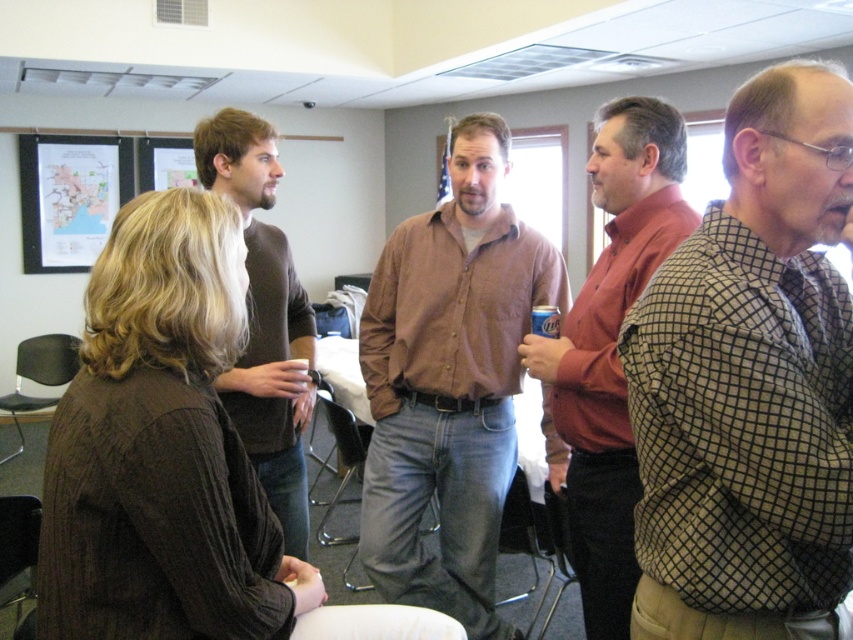
Can you confirm if brown shirt at center is positioned above dark brown sweater at center?

No, brown shirt at center is not above dark brown sweater at center.

Who is positioned more to the left, brown shirt at center or dark brown sweater at center?

From the viewer's perspective, dark brown sweater at center appears more on the left side.

Who is more forward, (380, 461) or (227, 118)?

Point (227, 118)

What are the coordinates of `brown shirt at center` in the screenshot? It's located at (450, 381).

Can you confirm if checkered fabric shirt at right is bigger than brown shirt at center?

Actually, checkered fabric shirt at right might be smaller than brown shirt at center.

Measure the distance between checkered fabric shirt at right and brown shirt at center.

checkered fabric shirt at right and brown shirt at center are 3.46 feet apart.

Is point (776, 266) positioned before point (485, 563)?

Yes.

Find the location of `checkered fabric shirt at right`. checkered fabric shirt at right is located at coordinates (750, 381).

Does checkered fabric shirt at right appear under dark brown sweater at center?

Yes, checkered fabric shirt at right is below dark brown sweater at center.

Locate an element on the screen. The image size is (853, 640). checkered fabric shirt at right is located at coordinates (750, 381).

Find the location of a particular element. This screenshot has height=640, width=853. checkered fabric shirt at right is located at coordinates (750, 381).